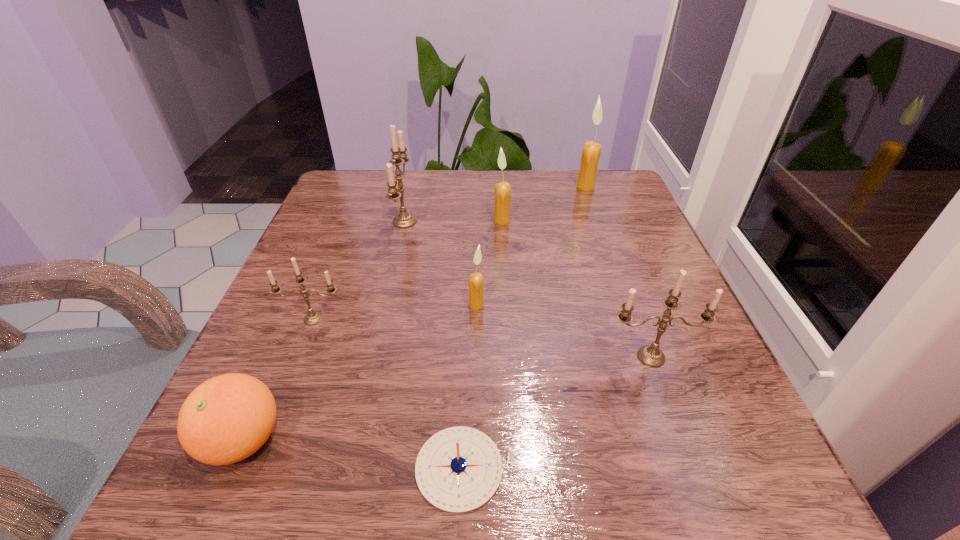
Where is `blank space at the far edge`? The width and height of the screenshot is (960, 540). blank space at the far edge is located at coordinates (439, 207).

The height and width of the screenshot is (540, 960). I want to click on free spot at the near edge of the desktop, so click(414, 470).

Where is `free region at the left edge`? free region at the left edge is located at coordinates (328, 224).

Locate an element on the screen. free space at the right edge is located at coordinates (630, 278).

I want to click on free space at the far left corner of the desktop, so click(363, 200).

In order to click on blank area at the near left corner in this screenshot , I will do `click(174, 496)`.

Locate an element on the screen. vacant space at the far right corner of the desktop is located at coordinates (568, 200).

Find the location of a particular element. free area in between the blue compass and the third object from right to left is located at coordinates (480, 344).

Where is `free spot between the leftmost candle and the nearest candle`? free spot between the leftmost candle and the nearest candle is located at coordinates (482, 338).

Identify the location of free space that is in between the second candle from left to right and the third candle from right to left. (453, 221).